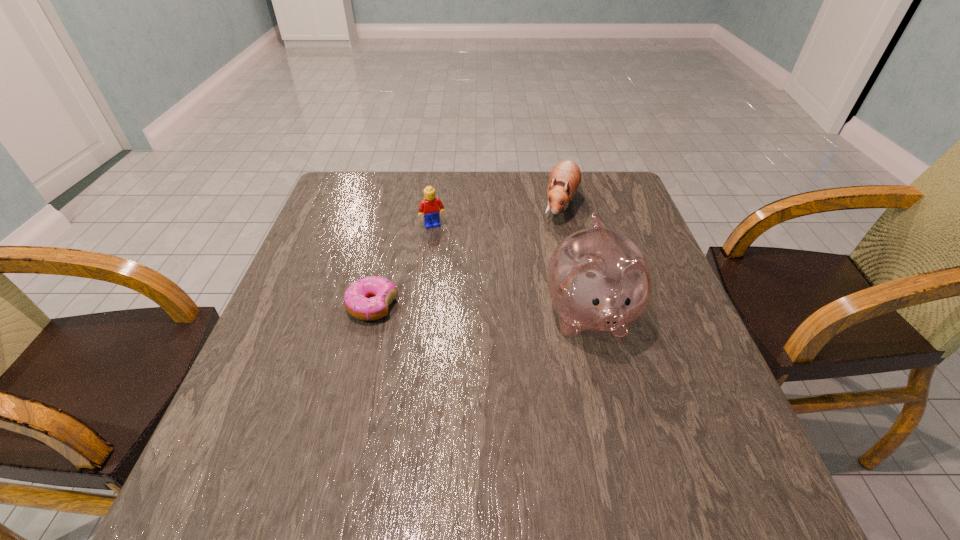
Locate an element on the screen. The height and width of the screenshot is (540, 960). free space located 0.250m on the front-facing side of the third object from right to left is located at coordinates (460, 292).

Identify the location of vacant space located on the front-facing side of the third object from right to left. The image size is (960, 540). tap(443, 245).

Find the location of a particular element. The image size is (960, 540). vacant region located on the front-facing side of the third object from right to left is located at coordinates (455, 280).

Locate an element on the screen. object that is positioned at the far edge is located at coordinates (565, 178).

Where is `object situated at the left edge`? object situated at the left edge is located at coordinates (368, 298).

Locate an element on the screen. This screenshot has width=960, height=540. object at the right edge is located at coordinates (598, 279).

At what (x,y) coordinates should I click in order to perform the action: click on free space at the far edge of the desktop. Please return your answer as a coordinate pair (x, y). Looking at the image, I should click on (507, 186).

You are a GUI agent. You are given a task and a screenshot of the screen. Output one action in this format:
    pyautogui.click(x=<x>, y=<y>)
    Task: Click on the free space at the near edge
    
    Given the screenshot: What is the action you would take?
    pyautogui.click(x=599, y=410)

Find the location of a particular element. vacant space at the left edge of the desktop is located at coordinates (332, 297).

Identify the location of blank space at the right edge of the desktop. (635, 381).